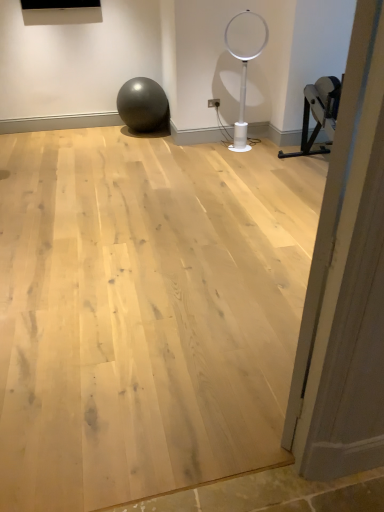
The image size is (384, 512). I want to click on free spot above natural wood floor at center (from a real-world perspective), so tap(148, 223).